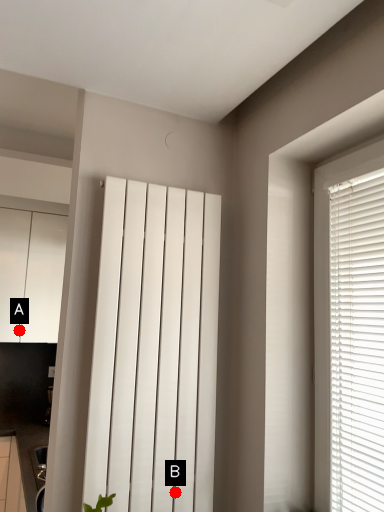
Question: Two points are circled on the image, labeled by A and B beside each circle. Which point is closer to the camera taking this photo?

Choices:
 (A) A is closer
 (B) B is closer

Answer: (B)